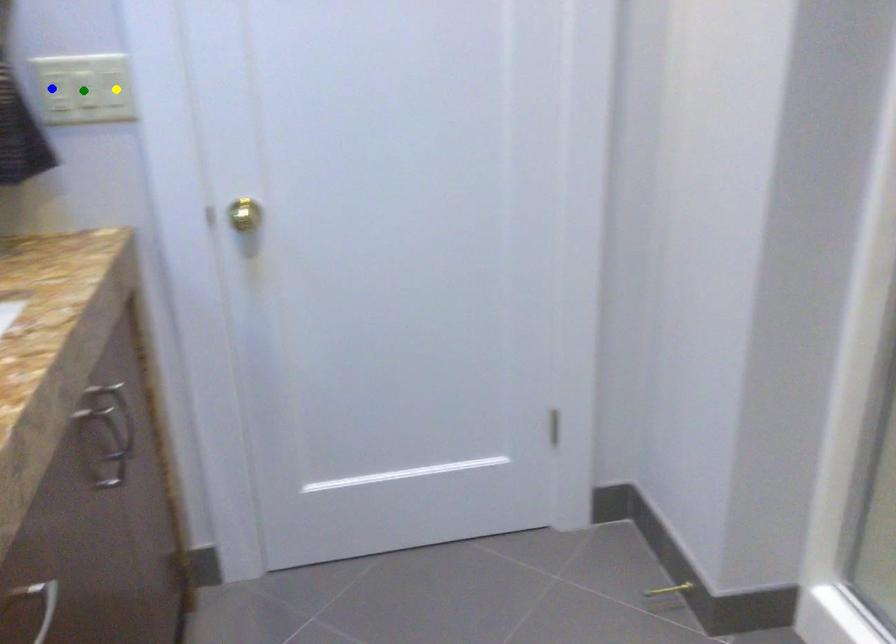
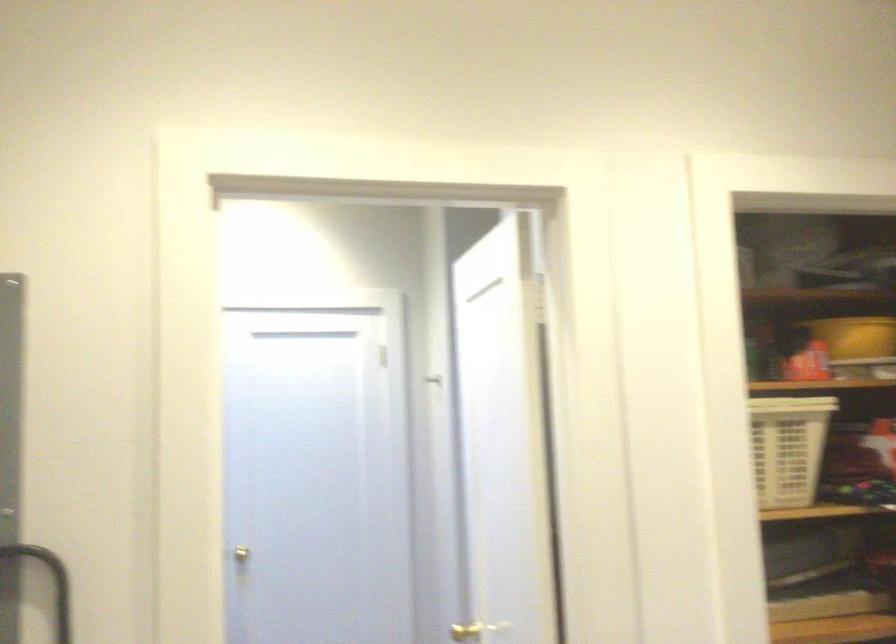
I am providing you with two images of the same scene from different viewpoints. Three points are marked in image1. Which point corresponds to a part or object that is occluded in image2?In image1, three points are marked. Which of them correspond to a part or object that is occluded in image2?Among the three points shown in image1, which one corresponds to a part or object that is no longer visible due to occlusion in image2?

Invisible in image2: green point, yellow point, blue point.